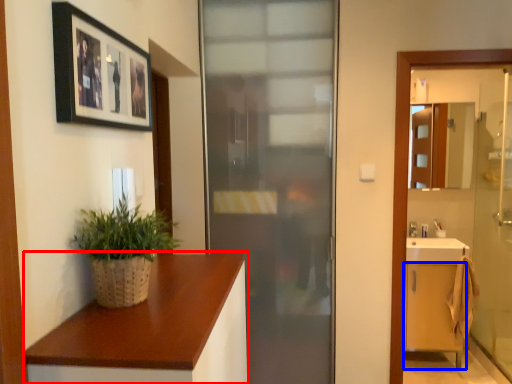
Question: Which object is further to the camera taking this photo, countertop (highlighted by a red box) or cabinetry (highlighted by a blue box)?

Choices:
 (A) countertop
 (B) cabinetry

Answer: (B)